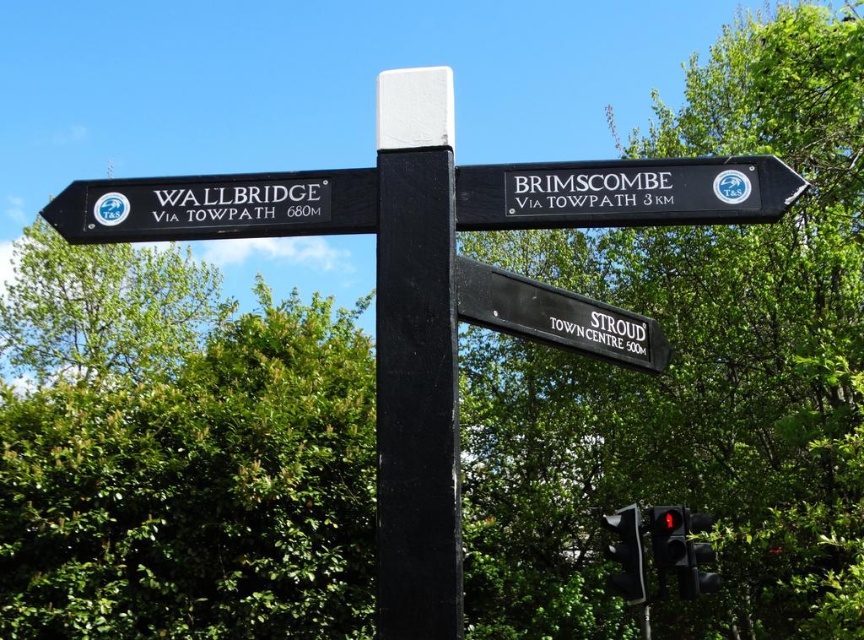
Question: Considering the real-world distances, which object is closest to the black smooth post at center?

Choices:
 (A) black wood signpost at upper right
 (B) green leafy tree at upper center
 (C) red glass traffic light at lower right
 (D) matte black traffic light at lower right

Answer: (A)

Question: Is black plastic sign at left to the left of black plastic sign at lower right from the viewer's perspective?

Choices:
 (A) yes
 (B) no

Answer: (A)

Question: Which of the following is the closest to the observer?

Choices:
 (A) (624, 211)
 (B) (456, 285)
 (C) (634, 531)

Answer: (B)

Question: Can you confirm if black plastic sign at lower right is positioned above matte black traffic light at lower right?

Choices:
 (A) no
 (B) yes

Answer: (B)

Question: Which point appears closest to the camera in this image?

Choices:
 (A) [x=510, y=305]
 (B) [x=175, y=195]
 (C) [x=674, y=528]
 (D) [x=638, y=588]

Answer: (A)

Question: Can you confirm if green leafy tree at upper center is bigger than matte black traffic light at lower right?

Choices:
 (A) yes
 (B) no

Answer: (A)